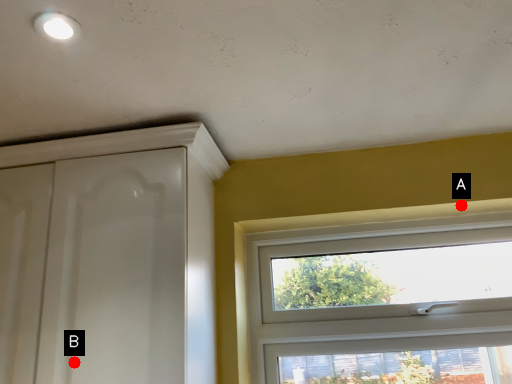
Question: Two points are circled on the image, labeled by A and B beside each circle. Which point is closer to the camera?

Choices:
 (A) A is closer
 (B) B is closer

Answer: (B)